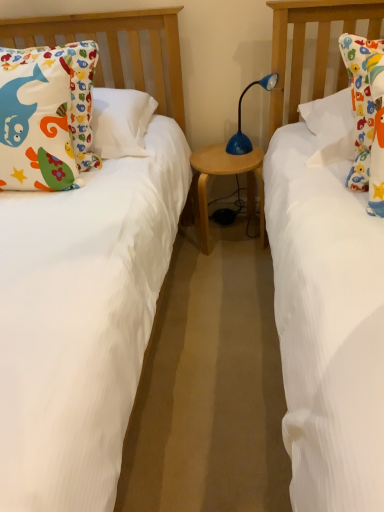
Image resolution: width=384 pixels, height=512 pixels. Describe the element at coordinates (240, 118) in the screenshot. I see `blue plastic table lamp at center` at that location.

I want to click on wooden table at center, so click(225, 175).

Can you tell me how much matte cotton pillow at left and wooden table at center differ in facing direction?

The facing directions of matte cotton pillow at left and wooden table at center are 12.1 degrees apart.

How distant is matte cotton pillow at left from wooden table at center?

They are 29.31 inches apart.

Is wooden table at center completely or partially inside matte cotton pillow at left?

No, wooden table at center is not a part of matte cotton pillow at left.

Between matte cotton pillow at left and wooden table at center, which one has larger size?

matte cotton pillow at left is bigger.

Is blue plastic table lamp at center shorter than matte cotton pillow at left?

Indeed, blue plastic table lamp at center has a lesser height compared to matte cotton pillow at left.

Which object is more forward, blue plastic table lamp at center or matte cotton pillow at left?

matte cotton pillow at left.

How different are the orientations of blue plastic table lamp at center and matte cotton pillow at left in degrees?

There is a 40.1-degree angle between the facing directions of blue plastic table lamp at center and matte cotton pillow at left.

From a real-world perspective, who is located higher, blue plastic table lamp at center or matte cotton pillow at left?

In real-world perspective, matte cotton pillow at left is above.

Is blue plastic table lamp at center aimed at wooden table at center?

No, blue plastic table lamp at center does not turn towards wooden table at center.

Is blue plastic table lamp at center bigger or smaller than wooden table at center?

blue plastic table lamp at center is smaller than wooden table at center.

Can you tell me how much blue plastic table lamp at center and wooden table at center differ in facing direction?

blue plastic table lamp at center and wooden table at center are facing 52.2 degrees away from each other.

Between blue plastic table lamp at center and wooden table at center, which one has larger width?

With larger width is wooden table at center.

Considering the sizes of objects matte cotton pillow at left and blue plastic table lamp at center in the image provided, who is bigger, matte cotton pillow at left or blue plastic table lamp at center?

matte cotton pillow at left is bigger.

Measure the distance between matte cotton pillow at left and blue plastic table lamp at center.

89.49 centimeters.

Is point (96, 56) farther from viewer compared to point (275, 73)?

No, (96, 56) is in front of (275, 73).

Does matte cotton pillow at left touch blue plastic table lamp at center?

They are not placed beside each other.

Which of these two, wooden table at center or matte cotton pillow at left, is smaller?

Smaller between the two is wooden table at center.

Based on their positions, is wooden table at center located to the left or right of matte cotton pillow at left?

In the image, wooden table at center appears on the right side of matte cotton pillow at left.

From the image's perspective, between wooden table at center and matte cotton pillow at left, who is located below?

wooden table at center is shown below in the image.

Is wooden table at center facing towards matte cotton pillow at left?

No, wooden table at center does not turn towards matte cotton pillow at left.

Measure the distance from wooden table at center to blue plastic table lamp at center.

wooden table at center and blue plastic table lamp at center are 8.22 inches apart from each other.

From the picture: Which object is positioned more to the left, wooden table at center or blue plastic table lamp at center?

From the viewer's perspective, wooden table at center appears more on the left side.

This screenshot has width=384, height=512. Find the location of `table lamp above the wooden table at center (from the image's perspective)`. table lamp above the wooden table at center (from the image's perspective) is located at coordinates (240, 118).

Looking at this image, is wooden table at center in contact with blue plastic table lamp at center?

No.

Where is `pillow above the wooden table at center (from the image's perspective)`? This screenshot has height=512, width=384. pillow above the wooden table at center (from the image's perspective) is located at coordinates (46, 116).

What are the coordinates of `pillow that is on the left side of blue plastic table lamp at center` in the screenshot? It's located at 46,116.

Which object lies nearer to the anchor point blue plastic table lamp at center, wooden table at center or matte cotton pillow at left?

wooden table at center.

Considering their positions, is matte cotton pillow at left positioned further to blue plastic table lamp at center than wooden table at center?

matte cotton pillow at left is positioned further to the anchor blue plastic table lamp at center.

When comparing their distances from matte cotton pillow at left, does blue plastic table lamp at center or wooden table at center seem further?

The object further to matte cotton pillow at left is blue plastic table lamp at center.

Considering their positions, is blue plastic table lamp at center positioned closer to wooden table at center than matte cotton pillow at left?

blue plastic table lamp at center lies closer to wooden table at center than the other object.

Based on their spatial positions, is wooden table at center or blue plastic table lamp at center closer to matte cotton pillow at left?

The object closer to matte cotton pillow at left is wooden table at center.

Considering their positions, is matte cotton pillow at left positioned closer to wooden table at center than blue plastic table lamp at center?

blue plastic table lamp at center.

Locate an element on the screen. Image resolution: width=384 pixels, height=512 pixels. table located between matte cotton pillow at left and blue plastic table lamp at center in the left-right direction is located at coordinates (225, 175).